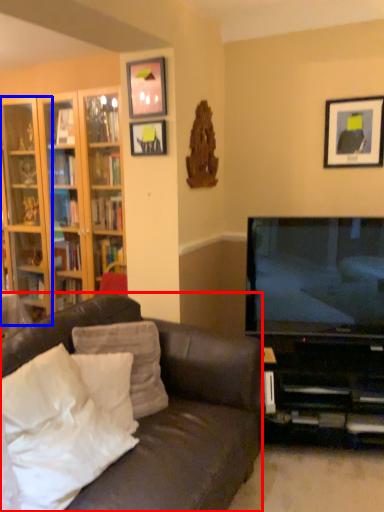
Question: Among these objects, which one is farthest to the camera, studio couch (highlighted by a red box) or shelf (highlighted by a blue box)?

Choices:
 (A) studio couch
 (B) shelf

Answer: (B)